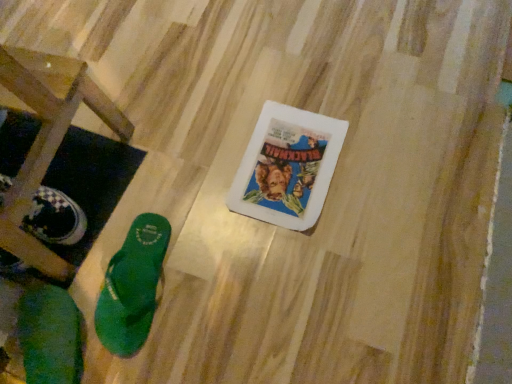
Locate an element on the screen. The height and width of the screenshot is (384, 512). vacant space that is in between green fabric flip-flop at lower left, positioned as the first footwear in left-to-right order, and green rubber flip-flop at lower left, which is counted as the first footwear, starting from the right is located at coordinates (98, 289).